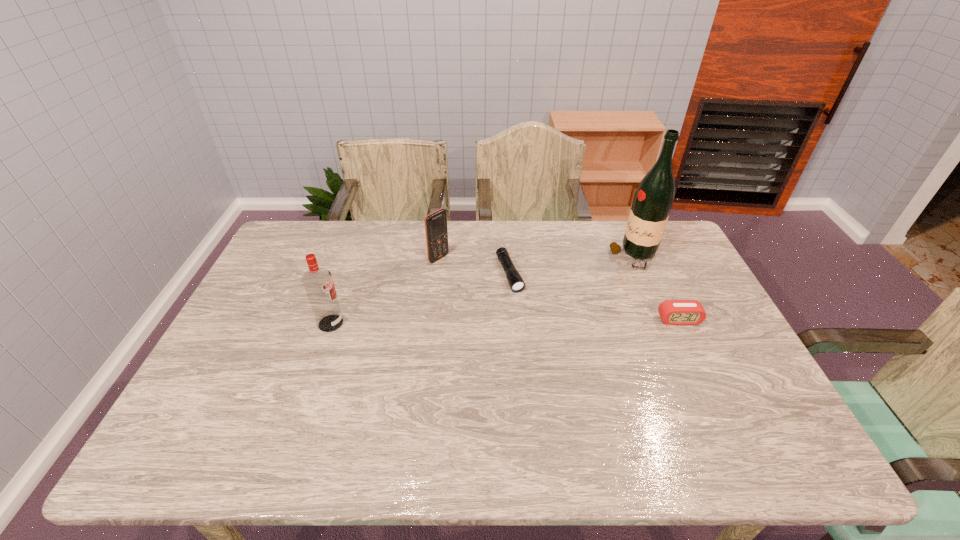
Where is `free space between the fourth tallest object and the third shortest object`? free space between the fourth tallest object and the third shortest object is located at coordinates (559, 289).

Locate an element on the screen. blank region between the cellular telephone and the leftmost object is located at coordinates (385, 291).

This screenshot has width=960, height=540. Find the location of `blank region between the third object from right to left and the fourth object from right to left`. blank region between the third object from right to left and the fourth object from right to left is located at coordinates (474, 266).

Find the location of a particular element. vacant region between the fourth shortest object and the fourth object from right to left is located at coordinates (385, 291).

Where is `free point between the vodka and the shortest object`? The width and height of the screenshot is (960, 540). free point between the vodka and the shortest object is located at coordinates point(420,299).

You are a GUI agent. You are given a task and a screenshot of the screen. Output one action in this format:
    pyautogui.click(x=<x>, y=<y>)
    Task: Click on the vacant region between the wine bottle and the flashlight
    This screenshot has height=540, width=960.
    Given the screenshot: What is the action you would take?
    pos(572,265)

Find the location of a particular element. free point between the third shortest object and the wine bottle is located at coordinates tap(537, 257).

Locate an element on the screen. Image resolution: width=960 pixels, height=540 pixels. vacant space that is in between the alarm clock and the fourth object from right to left is located at coordinates (559, 289).

This screenshot has height=540, width=960. What are the coordinates of `vacant region between the vodka and the flashlight` in the screenshot? It's located at (420, 299).

I want to click on object that is the third closest to the fourth shortest object, so click(x=654, y=197).